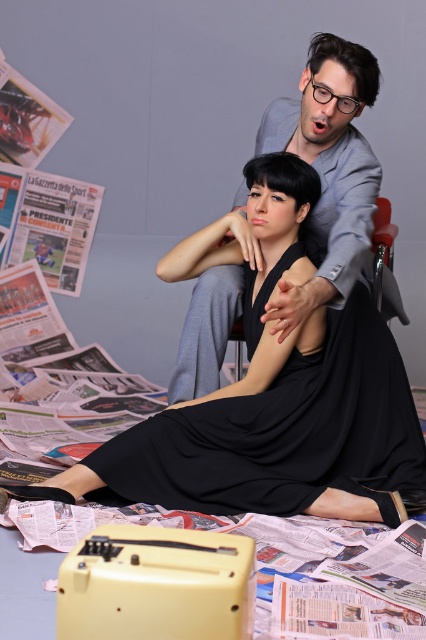
You are a photographer setting up a shoot in this scene. You need to place a small prop between the black satin dress at center and the gray suit at center. Based on their positions, where should the prop be placed?

The black satin dress at center is located below the gray suit at center, so the prop should be placed between them in the space above the black satin dress at center and below the gray suit at center.

Looking at this image, you are a photographer setting up a shoot. You need to place a light on the left side of the black satin dress at center to highlight it. Will the light also illuminate the gray suit at center?

The black satin dress at center is positioned on the right side of gray suit at center, so placing the light on the left side of the dress would also illuminate the gray suit at center since they are adjacent to each other.

You are a photographer trying to capture a candid shot of the black satin dress at center and the gray suit at center. What is the minimum distance you need to maintain between the two subjects to ensure both are in focus?

The black satin dress at center and gray suit at center are 12.07 inches apart from each other. To ensure both are in focus, the photographer should maintain a distance that allows the depth of field to cover this separation. Typically, a smaller aperture setting would help achieve this, but the exact distance depends on the camera lens and settings used.